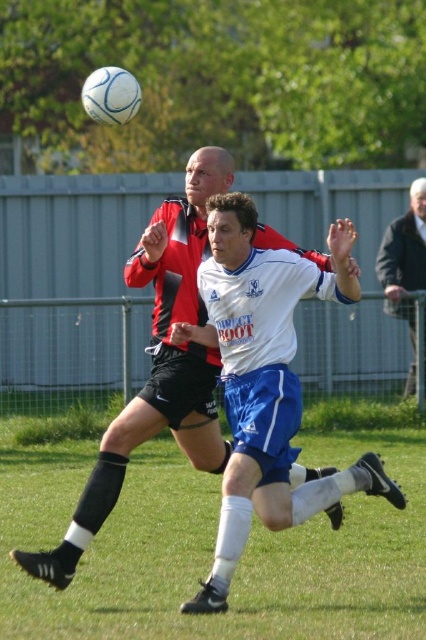
Question: Observing the image, what is the correct spatial positioning of green grass at center in reference to dark gray wool jacket at right?

Choices:
 (A) below
 (B) above

Answer: (A)

Question: Which point appears closest to the camera in this image?

Choices:
 (A) (362, 598)
 (B) (408, 260)
 (C) (195, 276)

Answer: (A)

Question: Is green grass at center below dark gray wool jacket at right?

Choices:
 (A) no
 (B) yes

Answer: (B)

Question: Which of the following is the farthest from the observer?

Choices:
 (A) green grass at center
 (B) white matte soccer ball at center
 (C) dark gray wool jacket at right

Answer: (C)

Question: Can you confirm if green grass at center is positioned above dark gray wool jacket at right?

Choices:
 (A) yes
 (B) no

Answer: (B)

Question: Which point is closer to the camera?

Choices:
 (A) (412, 236)
 (B) (158, 496)
 (C) (121, 426)
 (D) (342, 220)

Answer: (C)